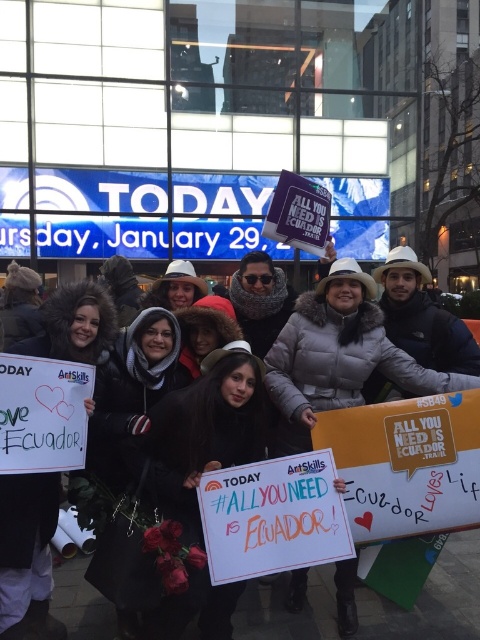
Consider the image. You are organizing a photo shoot and need to ensure that the white paper sign at center is clearly visible in the frame. Given the presence of the white fur coat at center, which object should you adjust to avoid blocking the sign?

The white fur coat at center is wider than the white paper sign at center, so you should adjust the position of the white fur coat at center to prevent it from blocking the sign.

You are a photographer trying to capture a clear shot of the white paper sign at center without any obstructions. Given the current arrangement, is the white fur coat at center blocking the view of the sign?

The white fur coat at center is positioned under the white paper sign at center, so the fur coat is not blocking the view of the sign as it is below it.

You are a photographer trying to capture a clear shot of the white paper sign at center without any obstructions. Considering the white fur coat at center, will you be able to see the entire sign in your photo?

The white fur coat at center is shorter than the white paper sign at center, so yes, the entire sign will be visible in the photo as the coat does not obstruct its full height.